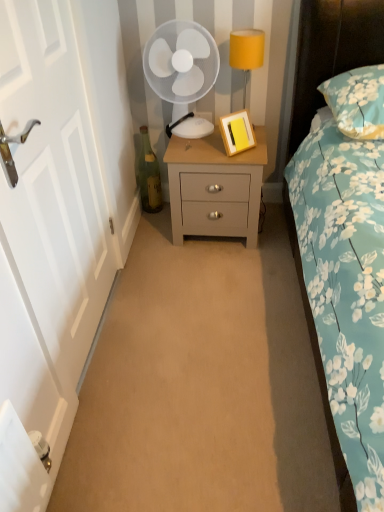
Locate an element on the screen. free spot in front of white painted wood door at left is located at coordinates (139, 410).